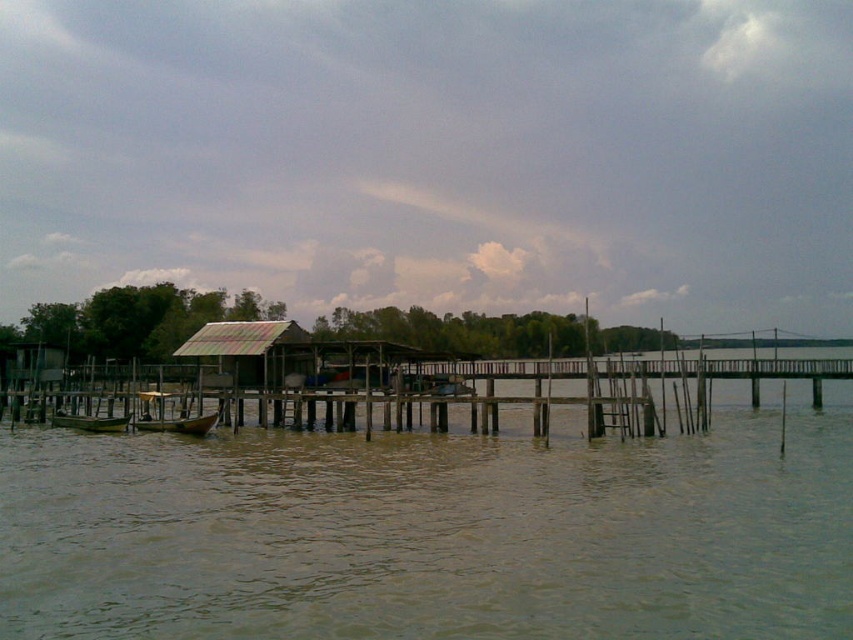
Question: Which point is farther from the camera taking this photo?

Choices:
 (A) (210, 356)
 (B) (190, 422)
 (C) (520, 628)
 (D) (106, 429)

Answer: (A)

Question: Does brown murky water at lower center have a larger size compared to rusty corrugated metal hut at center?

Choices:
 (A) no
 (B) yes

Answer: (A)

Question: Can you confirm if brown murky water at lower center is positioned to the left of rusty corrugated metal hut at center?

Choices:
 (A) no
 (B) yes

Answer: (A)

Question: Considering the real-world distances, which object is closest to the rusty corrugated metal hut at center?

Choices:
 (A) brown murky water at lower center
 (B) wooden boat at center

Answer: (B)

Question: Which object appears closest to the camera in this image?

Choices:
 (A) wooden boat at center
 (B) rusty corrugated metal hut at center
 (C) brown murky water at lower center

Answer: (C)

Question: Does rusty corrugated metal hut at center have a larger size compared to wooden boat at center?

Choices:
 (A) no
 (B) yes

Answer: (B)